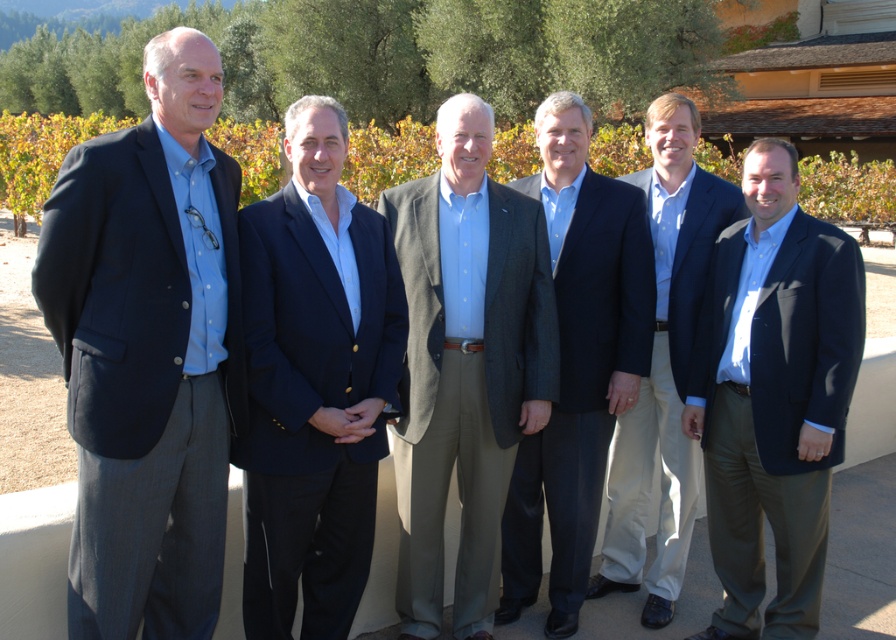
You are a photographer trying to capture a group photo of the six men in the vineyard. You want to ensure that both the point at coordinates point (x=329, y=291) and the point at coordinates point (x=549, y=198) are in focus. Which of these two points should you focus on to ensure both are sharp?

You should focus on the point that is farther from the camera, which is point (x=549, y=198). By focusing on the farther point, the depth of field will include the closer point as well, ensuring both are in focus.